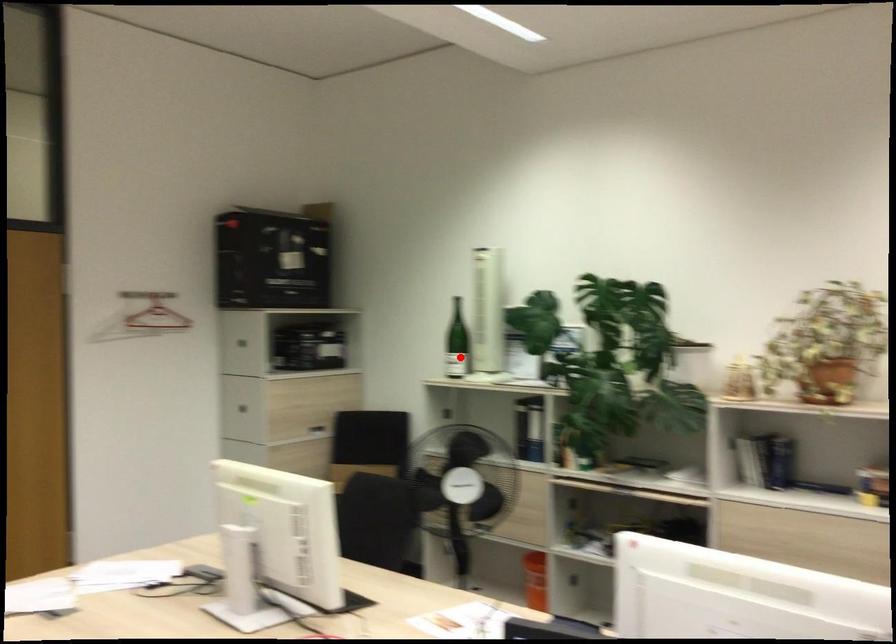
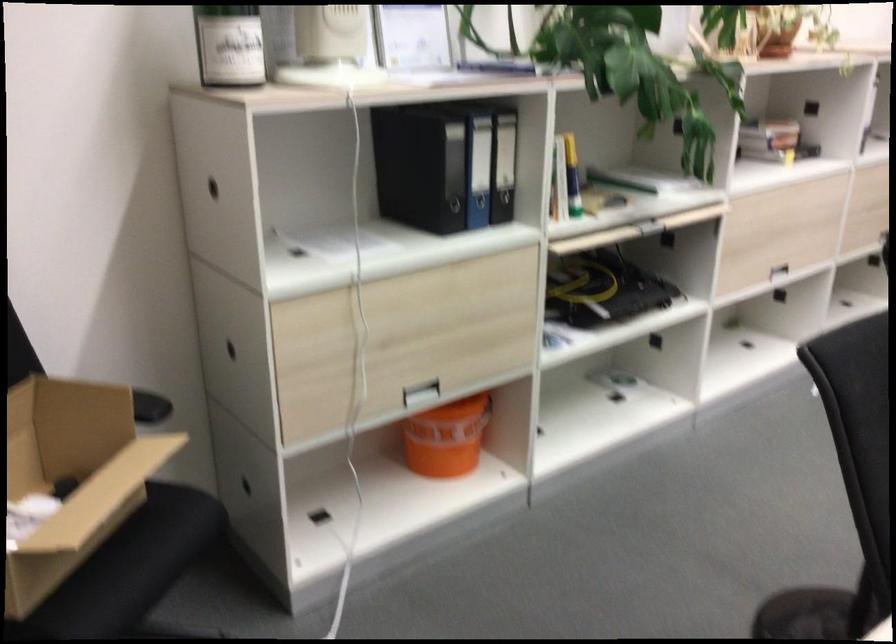
Question: I am providing you with two images of the same scene from different viewpoints. A red point is shown in image1. For the corresponding object point in image2, is it positioned nearer or farther from the camera?

Choices:
 (A) Nearer
 (B) Farther

Answer: (A)